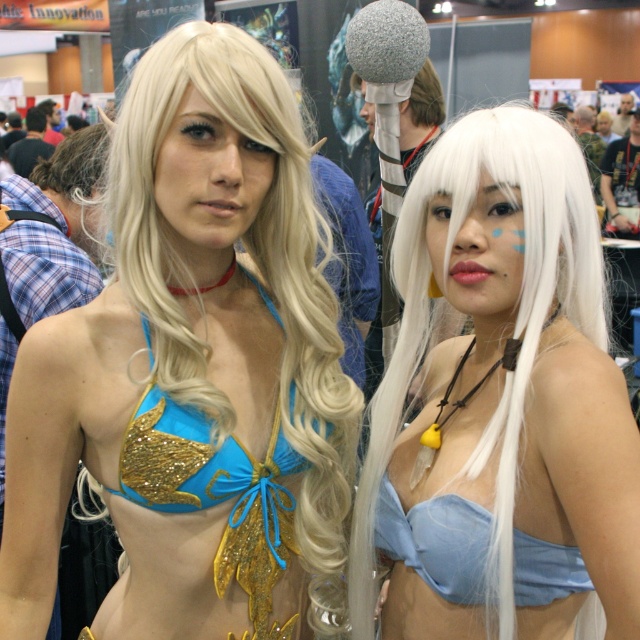
Does matte blue bikini top at center have a lesser height compared to glittery blue bikini top at center?

In fact, matte blue bikini top at center may be taller than glittery blue bikini top at center.

Who is higher up, matte blue bikini top at center or glittery blue bikini top at center?

Positioned higher is matte blue bikini top at center.

Is point (452, 358) closer to camera compared to point (156, 429)?

No, (452, 358) is behind (156, 429).

Find the location of a particular element. This screenshot has height=640, width=640. matte blue bikini top at center is located at coordinates (500, 404).

Does blue glitter bikini top at center appear on the left side of light blue satin bikini top at center?

Correct, you'll find blue glitter bikini top at center to the left of light blue satin bikini top at center.

The image size is (640, 640). I want to click on blue glitter bikini top at center, so coord(195,371).

Identify the location of blue glitter bikini top at center. Image resolution: width=640 pixels, height=640 pixels. (195, 371).

Identify the location of blue glitter bikini top at center. (195, 371).

Find the location of a particular element. The height and width of the screenshot is (640, 640). glittery blue bikini top at center is located at coordinates (218, 493).

Who is more forward, (122, 464) or (572, 582)?

Point (122, 464) is more forward.

Is point (248, 577) behind point (467, 588)?

Yes, it is behind point (467, 588).

The image size is (640, 640). I want to click on glittery blue bikini top at center, so click(x=218, y=493).